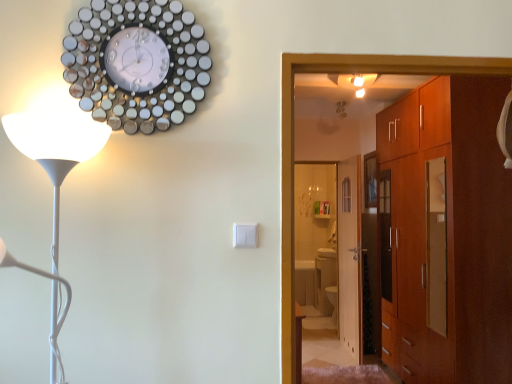
Question: From a real-world perspective, is wooden door at center above or below white glossy floor lamp at left?

Choices:
 (A) below
 (B) above

Answer: (A)

Question: From the image's perspective, is wooden door at center positioned above or below white glossy floor lamp at left?

Choices:
 (A) below
 (B) above

Answer: (A)

Question: Which object is positioned farthest from the white glossy floor lamp at left?

Choices:
 (A) metallic circular clock at upper left
 (B) wooden door at center
 (C) matte brown cabinet at right

Answer: (B)

Question: Which object is positioned closest to the matte brown cabinet at right?

Choices:
 (A) white glossy floor lamp at left
 (B) wooden door at center
 (C) metallic circular clock at upper left

Answer: (B)